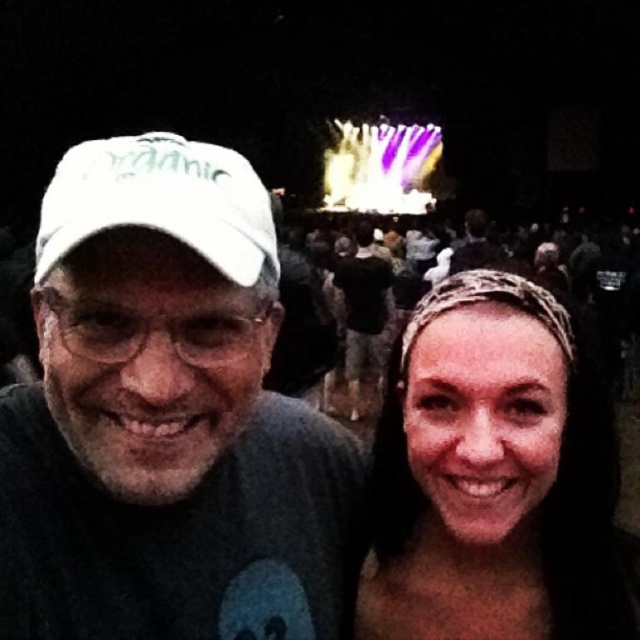
Which is below, white matte cap at upper left or smooth skin headband at center?

smooth skin headband at center is below.

Consider the image. Can you confirm if white matte cap at upper left is shorter than smooth skin headband at center?

Yes, white matte cap at upper left is shorter than smooth skin headband at center.

Between point (99, 300) and point (592, 556), which one is positioned behind?

Positioned behind is point (592, 556).

The height and width of the screenshot is (640, 640). What are the coordinates of `white matte cap at upper left` in the screenshot? It's located at (166, 417).

Does point (96, 262) come behind point (116, 141)?

That is False.

Is point (195, 310) positioned in front of point (140, 182)?

No, (195, 310) is behind (140, 182).

This screenshot has width=640, height=640. Identify the location of white matte cap at upper left. (166, 417).

I want to click on white matte cap at upper left, so click(166, 417).

Between point (554, 516) and point (144, 156), which one is positioned behind?

The point (554, 516) is more distant.

Between smooth skin headband at center and white fabric baseball cap at left, which one is positioned higher?

white fabric baseball cap at left is higher up.

The image size is (640, 640). What are the coordinates of `smooth skin headband at center` in the screenshot? It's located at (493, 474).